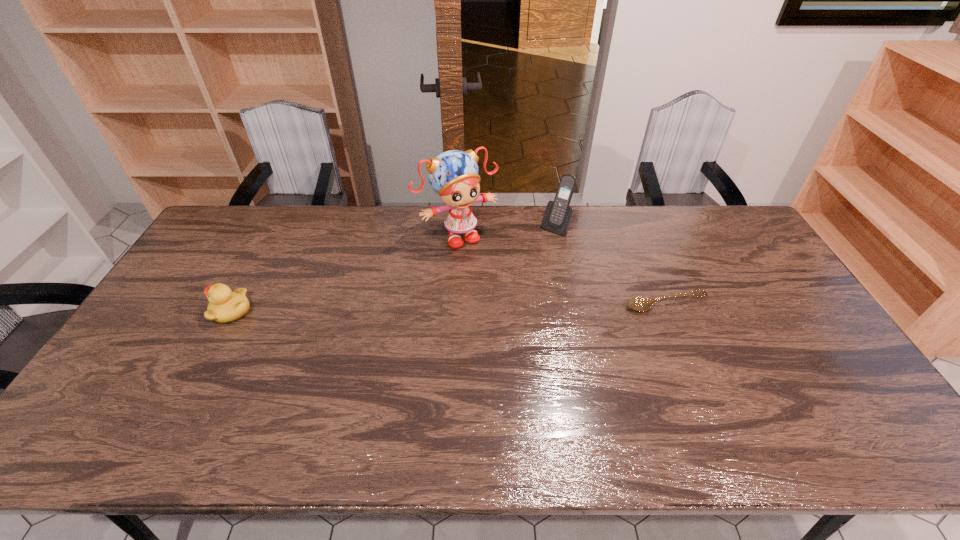
In the image, there is a desktop. Where is `blank space at the near edge`? Image resolution: width=960 pixels, height=540 pixels. blank space at the near edge is located at coordinates (503, 385).

You are a GUI agent. You are given a task and a screenshot of the screen. Output one action in this format:
    pyautogui.click(x=<x>, y=<y>)
    Task: Click on the vacant area at the left edge of the desktop
    This screenshot has width=960, height=540.
    Given the screenshot: What is the action you would take?
    pyautogui.click(x=196, y=307)

This screenshot has height=540, width=960. What are the coordinates of `blank space at the right edge of the desktop` in the screenshot? It's located at (759, 260).

Find the location of a particular element. vacant space at the far right corner of the desktop is located at coordinates (724, 226).

Locate an element on the screen. The height and width of the screenshot is (540, 960). free space at the near right corner of the desktop is located at coordinates (860, 399).

Identify the location of free area in between the ladle and the second object from left to right. (562, 269).

Find the location of `free space that is in between the third shortest object and the second shortest object`. free space that is in between the third shortest object and the second shortest object is located at coordinates (394, 268).

Image resolution: width=960 pixels, height=540 pixels. I want to click on free space between the third object from left to right and the shortest object, so click(611, 265).

Locate an element on the screen. This screenshot has height=540, width=960. vacant point located between the third object from right to left and the third tallest object is located at coordinates (345, 273).

Locate an element on the screen. The image size is (960, 540). vacant space in between the third object from left to right and the tallest object is located at coordinates (507, 231).